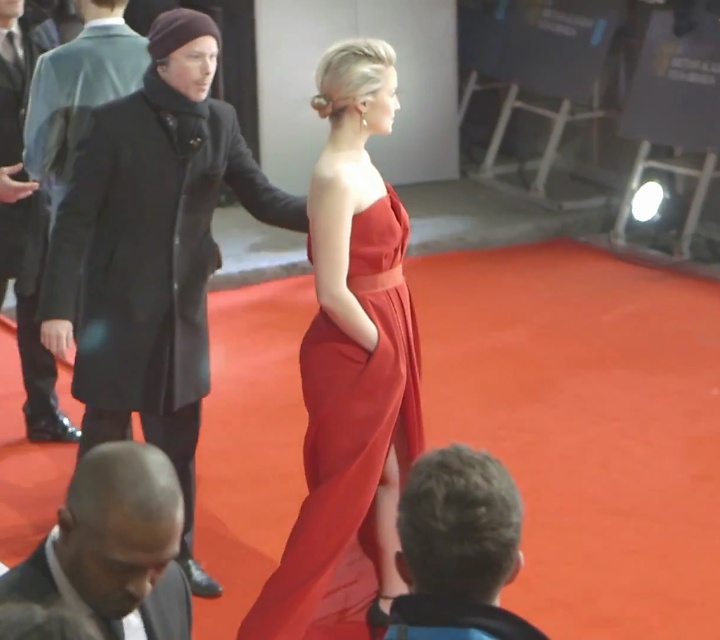
You are a photographer at the event and need to capture a closeup shot of the satin red dress at center without the black wool coat at center appearing in the frame. Is this possible given their sizes?

The black wool coat at center has a larger size compared to the satin red dress at center, so it might be challenging to frame the dress without including the coat due to its larger size.

You are a photographer at the event and need to capture a photo that includes both the smooth blue jacket at center and the black wool coat at left. Which jacket should you position to the left side of your frame to include both in the shot?

The black wool coat at left should be positioned to the left side of your frame because the smooth blue jacket at center is already on the right side of the black wool coat at left in the scene.